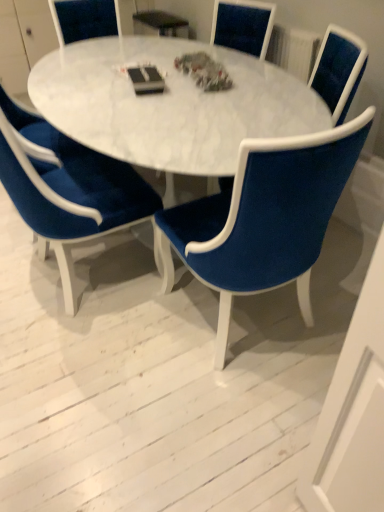
Question: Is velvet blue chair at center, the 1th chair positioned from the right, to the left or to the right of velvet blue chair at center, the first chair in the left-to-right sequence, in the image?

Choices:
 (A) left
 (B) right

Answer: (B)

Question: In terms of height, does velvet blue chair at center, the 1th chair positioned from the right, look taller or shorter compared to velvet blue chair at center, the first chair in the left-to-right sequence?

Choices:
 (A) short
 (B) tall

Answer: (A)

Question: Estimate the real-world distances between objects in this image. Which object is closer to the velvet blue chair at center, the 2th chair from the right?

Choices:
 (A) velvet blue chair at center, the 1th chair positioned from the right
 (B) white marble table at center
 (C) velvet blue chair at center, the 3th chair when ordered from right to left
 (D) white marble table at center

Answer: (B)

Question: Based on their relative distances, which object is nearer to the velvet blue chair at center, the 3th chair when ordered from right to left?

Choices:
 (A) white marble table at center
 (B) velvet blue chair at center, which is the 2th chair in left-to-right order
 (C) white marble table at center
 (D) velvet blue chair at center, the 1th chair positioned from the right

Answer: (C)